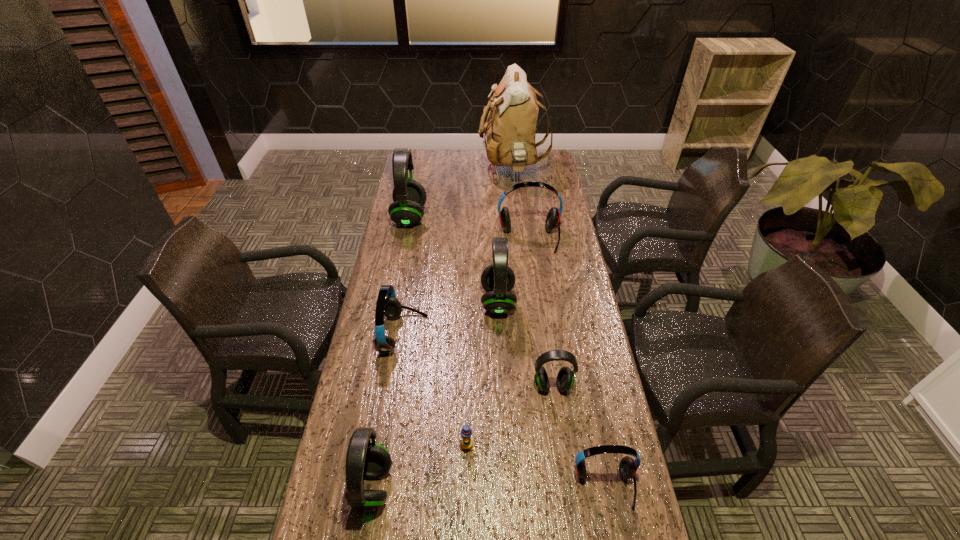
Identify the location of vacant space in between the sixth object from right to left and the smallest red headset. The width and height of the screenshot is (960, 540). pos(536,466).

Locate an element on the screen. unoccupied area between the third nearest black headset and the nearest black headset is located at coordinates (x=435, y=394).

Identify the location of the seventh closest object to the nearest red headset. (409, 196).

Locate an element on the screen. object that is the second closest to the farthest object is located at coordinates (552, 222).

You are a GUI agent. You are given a task and a screenshot of the screen. Output one action in this format:
    pyautogui.click(x=<x>, y=<y>)
    Task: Click on the headset that can be found as the sixth closest to the biggest black headset
    
    Given the screenshot: What is the action you would take?
    pyautogui.click(x=627, y=468)

This screenshot has width=960, height=540. Identify the location of headset that is the fourth closest to the nearest black headset. (498, 279).

The height and width of the screenshot is (540, 960). Find the location of `the closest black headset relative to the shortest object`. the closest black headset relative to the shortest object is located at coordinates click(x=364, y=459).

At what (x,y) coordinates should I click in order to perform the action: click on the closest black headset to the farthest object. Please return your answer as a coordinate pair (x, y). Looking at the image, I should click on (409, 196).

The image size is (960, 540). Identify the location of red headset identified as the third closest to the third black headset from left to right. (627, 468).

The width and height of the screenshot is (960, 540). What are the coordinates of `red headset that is the second closest to the third biggest black headset` in the screenshot? It's located at (627, 468).